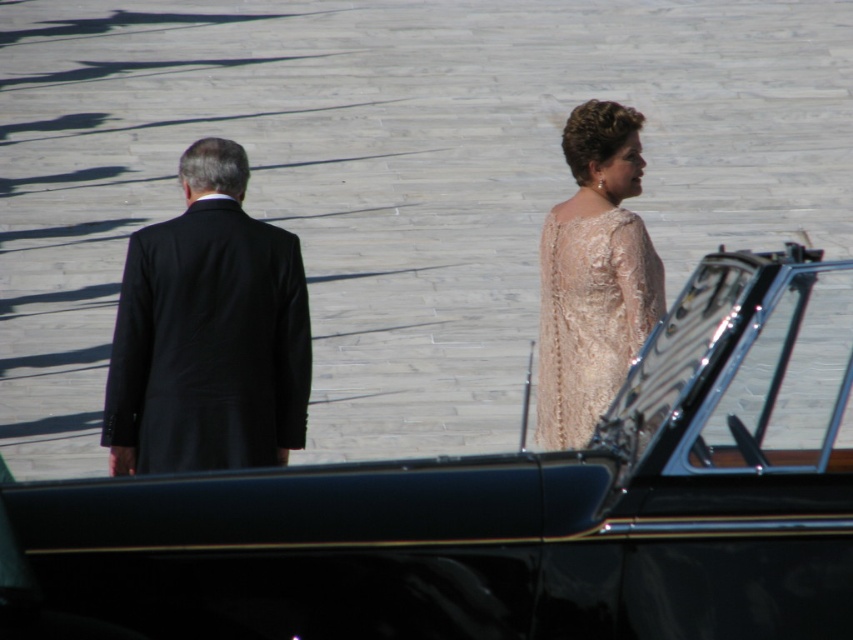
Can you confirm if black smooth suit at left is positioned to the right of ivory lace dress at right?

Incorrect, black smooth suit at left is not on the right side of ivory lace dress at right.

Is point (270, 323) less distant than point (556, 435)?

No, (270, 323) is behind (556, 435).

Between point (292, 397) and point (601, 376), which one is positioned behind?

Point (292, 397)

Identify the location of black smooth suit at left. point(207,332).

Does black glossy car at center appear on the right side of black smooth suit at left?

Indeed, black glossy car at center is positioned on the right side of black smooth suit at left.

Does black glossy car at center appear over black smooth suit at left?

Incorrect, black glossy car at center is not positioned above black smooth suit at left.

Which is in front, point (851, 625) or point (300, 352)?

Point (851, 625) is in front.

Where is `black glossy car at center`? Image resolution: width=853 pixels, height=640 pixels. black glossy car at center is located at coordinates (508, 508).

Can you confirm if black glossy car at center is wider than matte black suit at left?

Yes, black glossy car at center is wider than matte black suit at left.

Who is taller, black glossy car at center or matte black suit at left?

matte black suit at left

Is point (310, 536) closer to camera compared to point (624, 307)?

Yes, point (310, 536) is in front of point (624, 307).

Where is `black glossy car at center`? black glossy car at center is located at coordinates pyautogui.click(x=508, y=508).